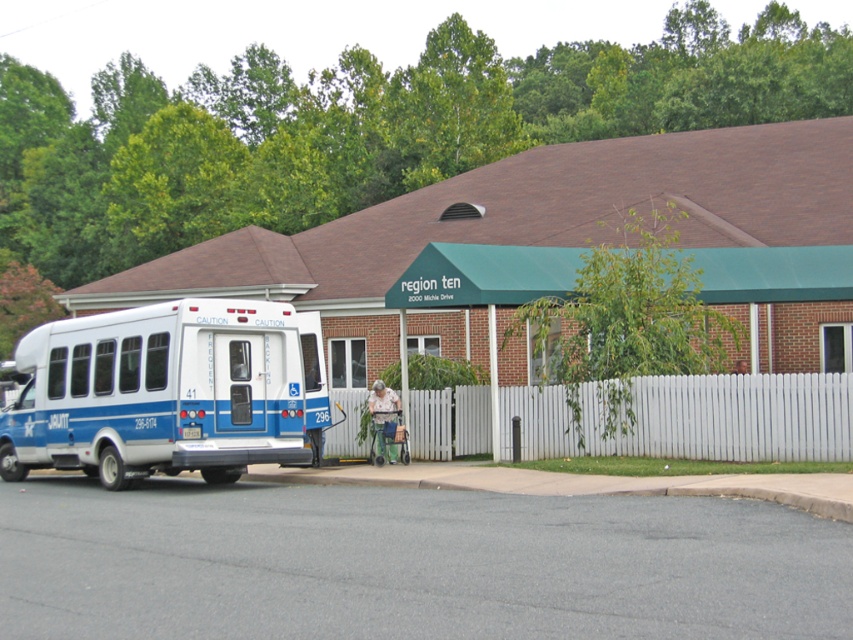
Is point (107, 408) less distant than point (703, 410)?

No, (107, 408) is further to viewer.

Is point (38, 340) less distant than point (840, 445)?

No, (38, 340) is further to viewer.

Where is `white glossy ambulance at left`? The height and width of the screenshot is (640, 853). white glossy ambulance at left is located at coordinates (167, 392).